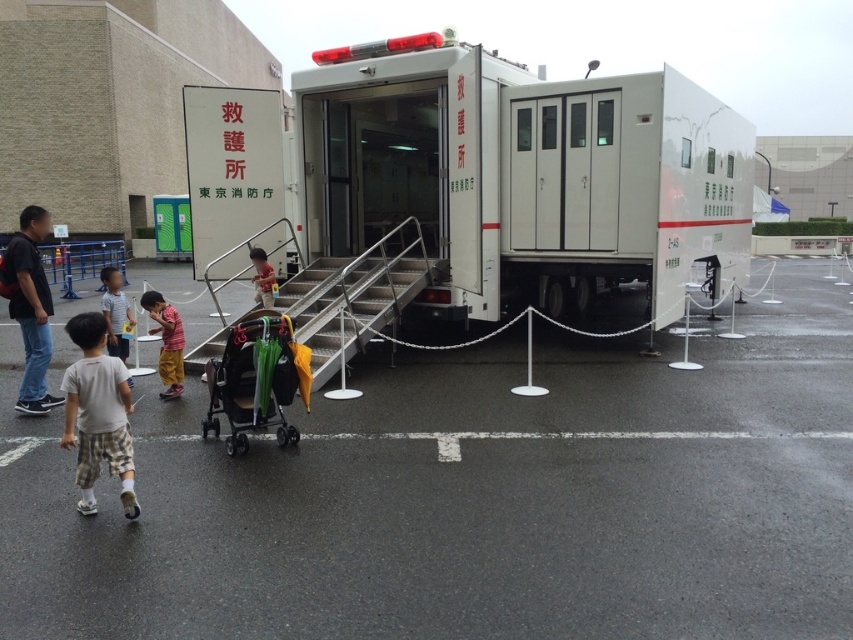
Question: Is white matte truck at center bigger than metallic silver stairs at center?

Choices:
 (A) yes
 (B) no

Answer: (A)

Question: Considering the real-world distances, which object is closest to the white matte truck at center?

Choices:
 (A) light gray shirt at lower left
 (B) gray asphalt parking lot at lower left
 (C) gray plaid shorts at lower left

Answer: (B)

Question: Considering the relative positions of gray plaid shorts at lower left and light gray shirt at lower left in the image provided, where is gray plaid shorts at lower left located with respect to light gray shirt at lower left?

Choices:
 (A) above
 (B) below

Answer: (B)

Question: Observing the image, what is the correct spatial positioning of green plastic baby carriage at center in reference to gray plaid shorts at lower left?

Choices:
 (A) below
 (B) above

Answer: (A)

Question: Among these points, which one is farthest from the camera?

Choices:
 (A) (252, 429)
 (B) (735, 458)
 (C) (25, 209)
 (D) (682, 129)

Answer: (C)

Question: Among these objects, which one is nearest to the camera?

Choices:
 (A) metallic silver stairs at center
 (B) gray asphalt parking lot at lower left

Answer: (B)